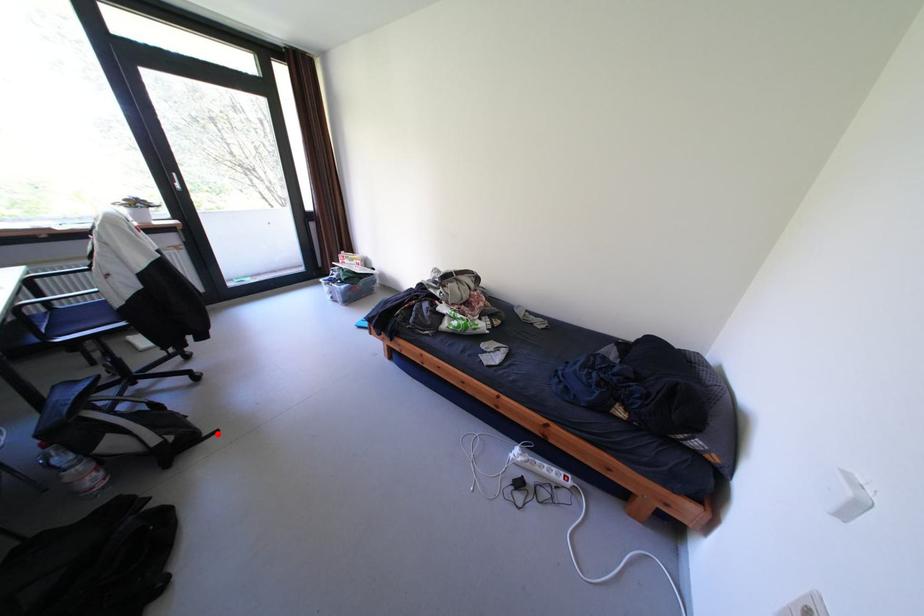
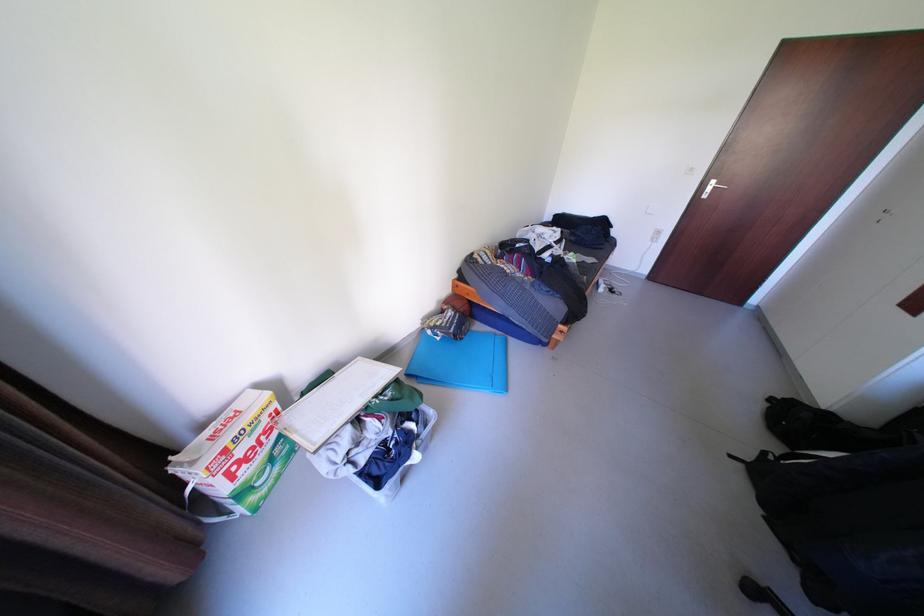
Question: I am providing you with two images of the same scene from different viewpoints. Given a red point in image1, look at the same physical point in image2. Is it:

Choices:
 (A) Closer to the viewpoint
 (B) Farther from the viewpoint

Answer: (B)